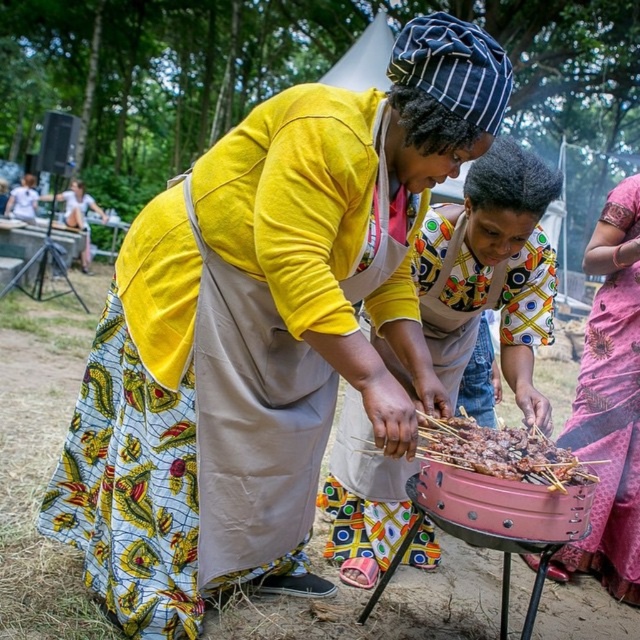
You are standing 5 feet away from the barbecue grill. The printed fabric shirt at center is part of a person who is holding a serving tray. Can you reach the serving tray if you extend your arm 1.5 feet?

The printed fabric shirt at center is 6.70 feet away from you. Since you are 5 feet away from the grill and the shirt is further away, the total distance is more than 6.70 feet. Extending your arm 1.5 feet would not be enough to reach the serving tray.

You are at a barbecue event and see two people wearing different clothes. The first person is wearing a printed fabric shirt at center, and the second is wearing a pink fabric dress at right. From your perspective, which clothing item is positioned higher up?

The printed fabric shirt at center is located above the pink fabric dress at right, so the printed fabric shirt at center is positioned higher up.

You are organizing a clothing display and need to arrange the printed fabric shirt at center and the pink fabric dress at right based on their widths. Which one should you place first if you want to arrange them from widest to narrowest?

The printed fabric shirt at center should be placed first because its width surpasses the pink fabric dress at right.